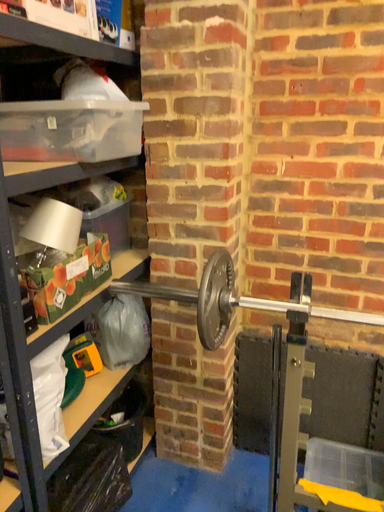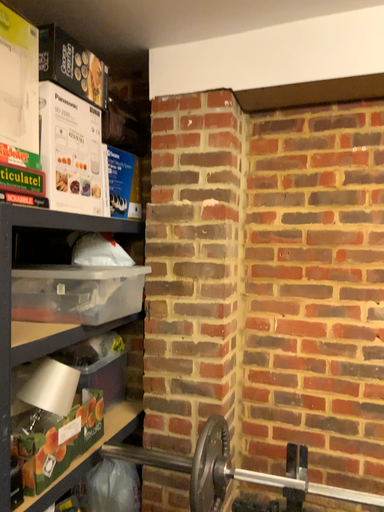
Question: How did the camera likely rotate when shooting the video?

Choices:
 (A) rotated upward
 (B) rotated downward

Answer: (A)